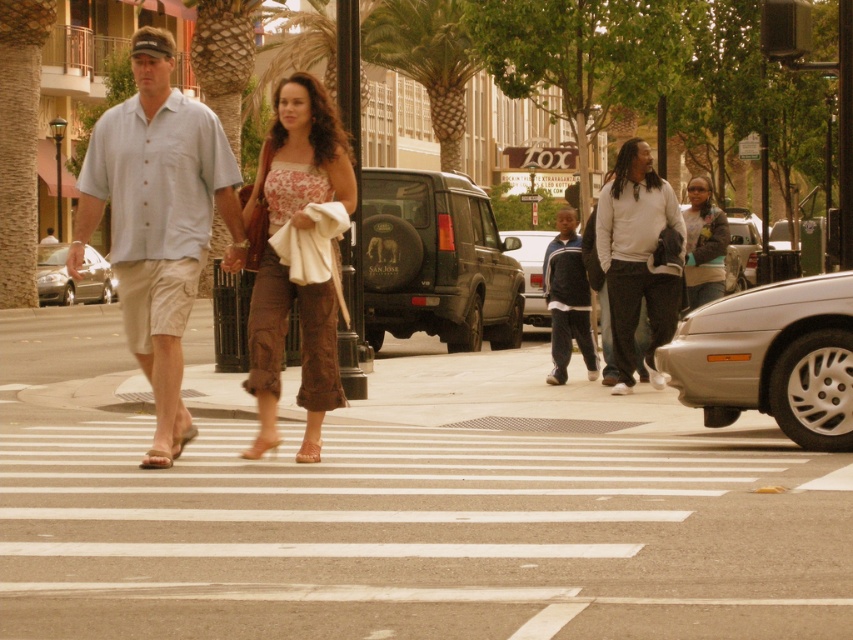
Question: Which of the following is the farthest from the observer?

Choices:
 (A) light blue cotton shirt at center
 (B) green leafy palm tree at center
 (C) matte beige sandal at lower center
 (D) brown leather sandal at lower left

Answer: (B)

Question: Among these objects, which one is nearest to the camera?

Choices:
 (A) white asphalt at center
 (B) brown leather sandal at center
 (C) white fleece jacket at center

Answer: (A)

Question: Can you confirm if silver metallic sedan at lower right is bigger than matte beige sandal at lower center?

Choices:
 (A) yes
 (B) no

Answer: (A)

Question: Among these objects, which one is farthest from the camera?

Choices:
 (A) beige fabric sandal at center
 (B) metallic silver sedan at center
 (C) denim jacket at right

Answer: (B)

Question: From the image, what is the correct spatial relationship of denim jacket at right in relation to brown leather sandal at lower left?

Choices:
 (A) below
 (B) above

Answer: (B)

Question: Does shiny silver sedan at left lie behind metallic silver sedan at center?

Choices:
 (A) yes
 (B) no

Answer: (A)